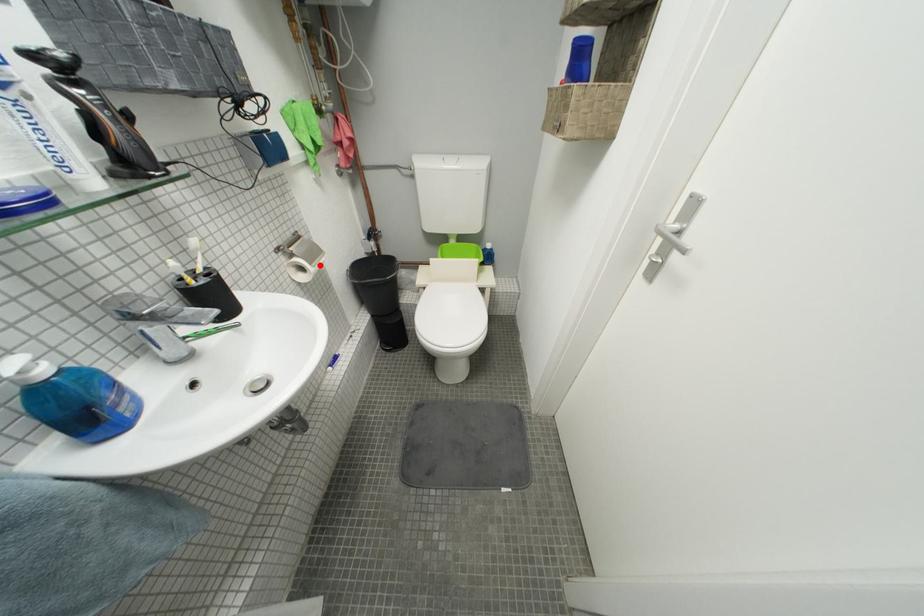
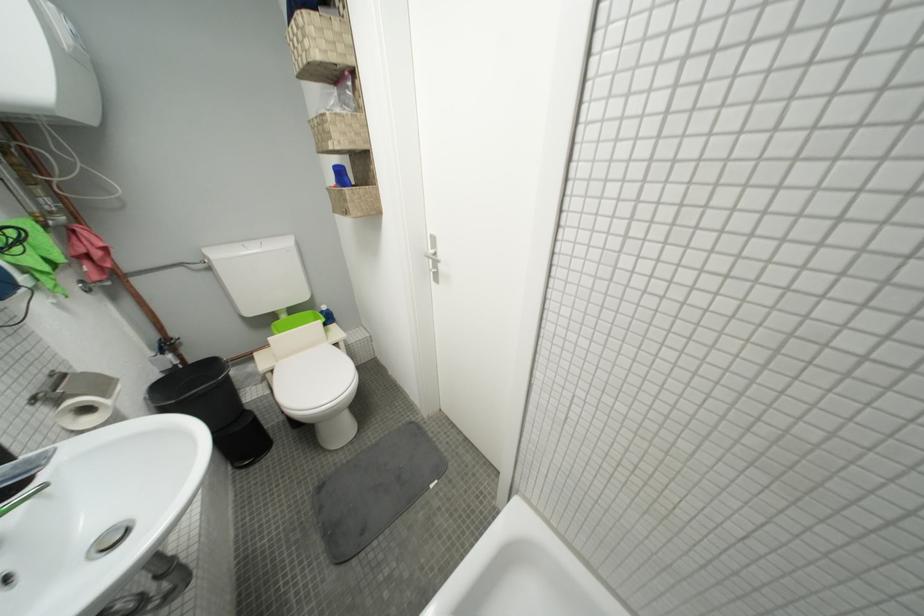
Question: I am providing you with two images of the same scene from different viewpoints. In image1, a red point is highlighted. Considering the same 3D point in image2, which of the following is correct?

Choices:
 (A) It is closer
 (B) It is farther

Answer: (B)